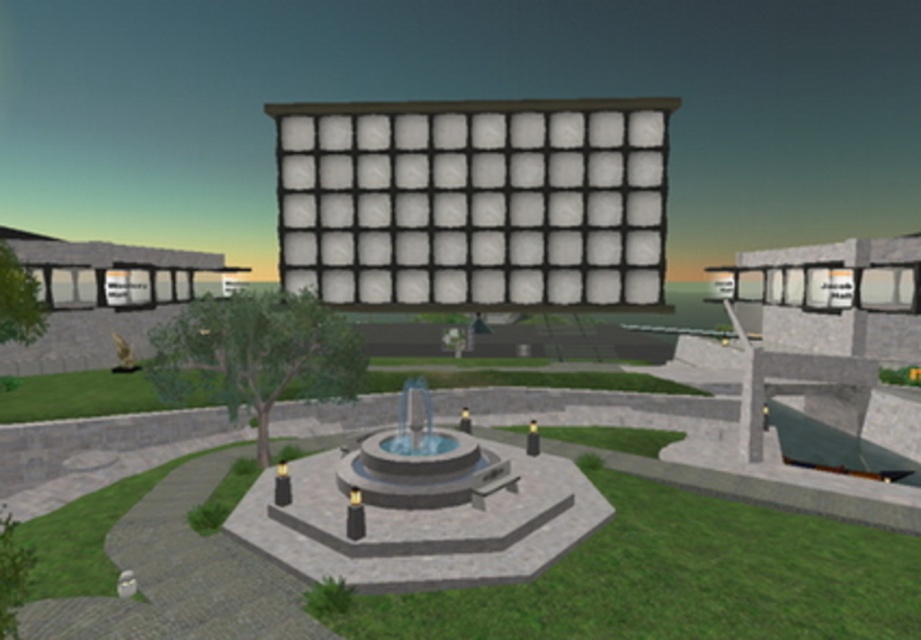
Is smooth gray fountain at center taller than clear glass fountain at center?

No.

Is smooth gray fountain at center positioned before clear glass fountain at center?

That is False.

Between point (322, 508) and point (469, 470), which one is positioned behind?

Point (469, 470)

Where is `smooth gray fountain at center`? The image size is (921, 640). smooth gray fountain at center is located at coordinates (421, 515).